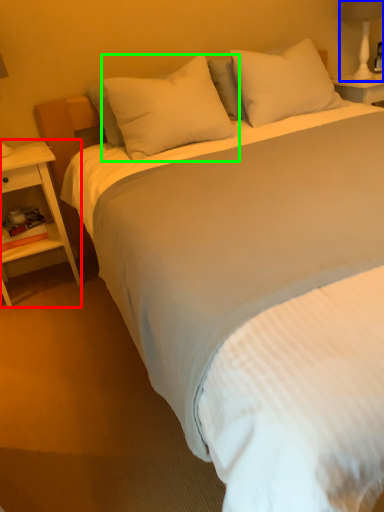
Question: Based on their relative distances, which object is nearer to nightstand (highlighted by a red box)? Choose from bedside lamp (highlighted by a blue box) and pillow (highlighted by a green box).

Choices:
 (A) bedside lamp
 (B) pillow

Answer: (B)